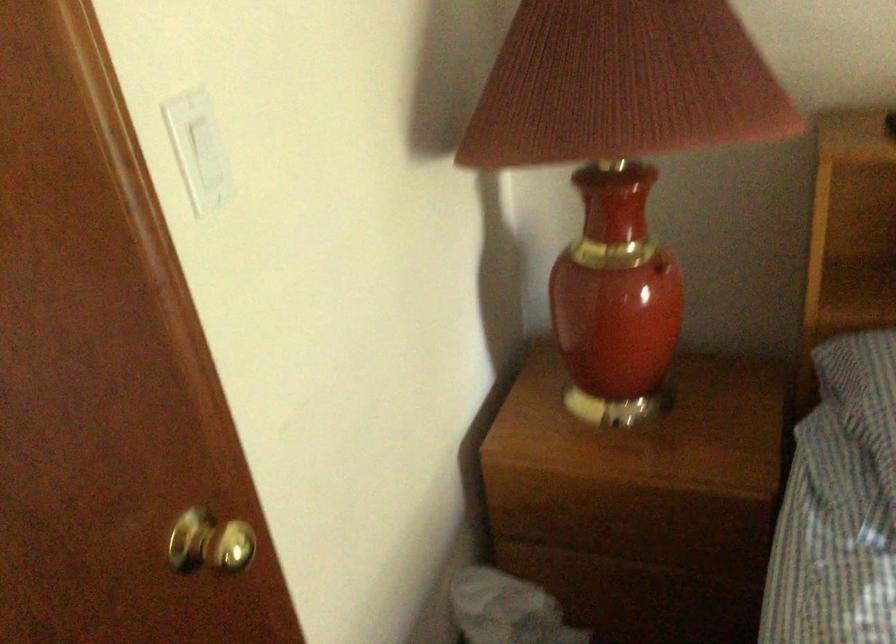
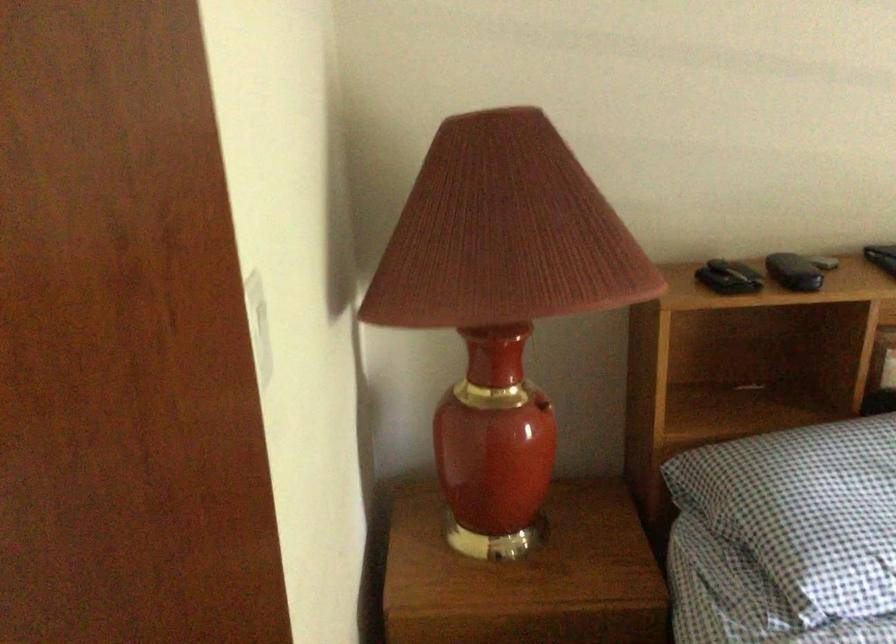
Question: The images are taken continuously from a first-person perspective. In which direction is your viewpoint rotating?

Choices:
 (A) Left
 (B) Right
 (C) Up
 (D) Down

Answer: (B)